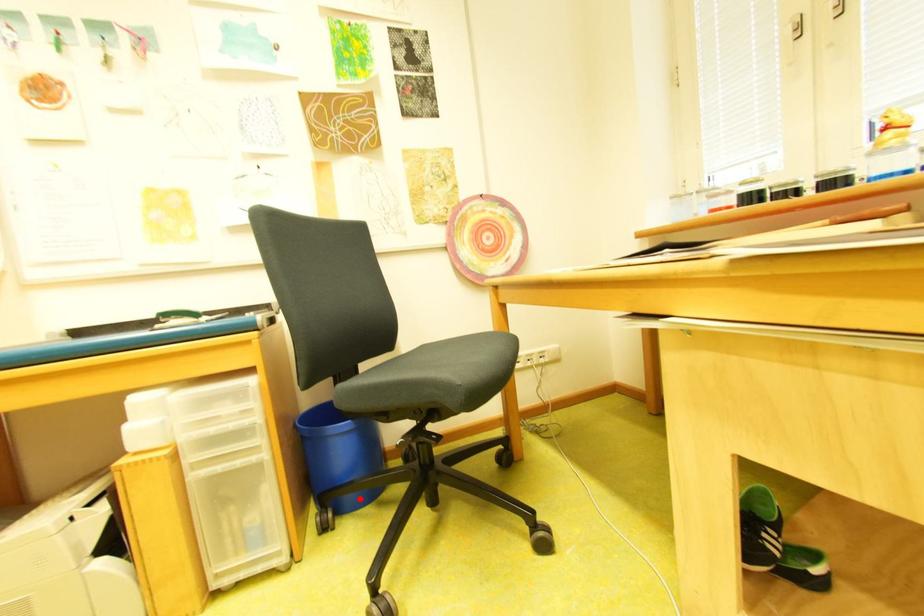
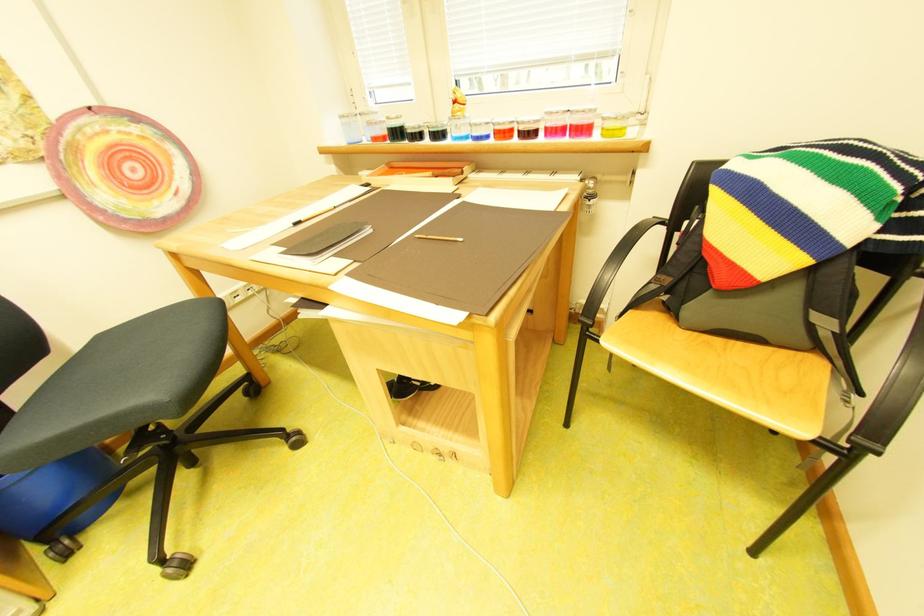
Question: I am providing you with two images of the same scene from different viewpoints. Given a red point in image1, look at the same physical point in image2. Is it:

Choices:
 (A) Closer to the viewpoint
 (B) Farther from the viewpoint

Answer: (B)